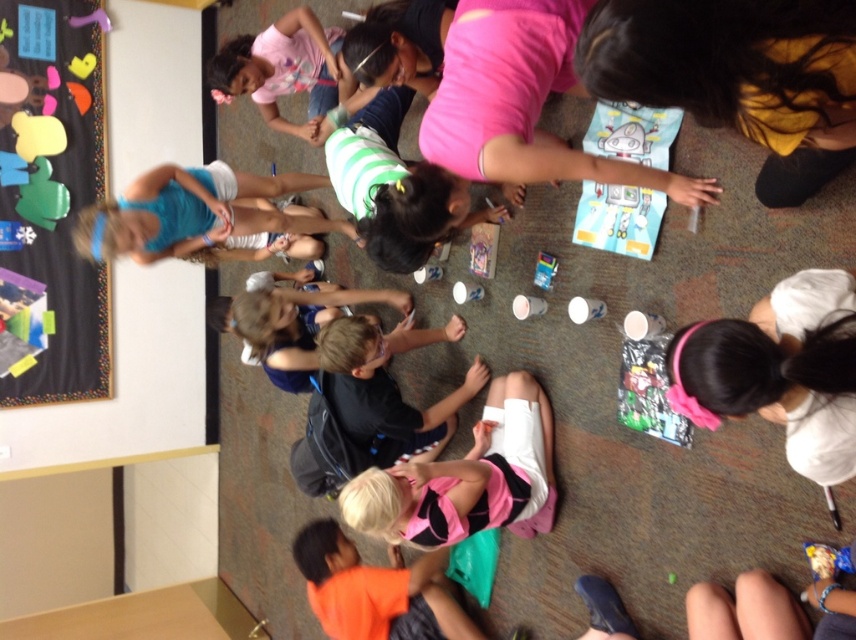
Question: Is black matte backpack at center above orange fabric at lower center?

Choices:
 (A) yes
 (B) no

Answer: (A)

Question: Which object is the farthest from the blue fabric dress at upper left?

Choices:
 (A) pink matte shirt at center
 (B) yellow fabric shirt at lower right
 (C) green striped shirt at center

Answer: (B)

Question: Does black matte backpack at center have a lesser width compared to green striped shirt at center?

Choices:
 (A) no
 (B) yes

Answer: (A)

Question: Which of the following is the farthest from the observer?

Choices:
 (A) (730, 369)
 (B) (176, 224)
 (C) (777, 189)
 (D) (455, 140)

Answer: (B)

Question: Does yellow fabric shirt at lower right appear on the left side of black matte backpack at center?

Choices:
 (A) yes
 (B) no

Answer: (B)

Question: Among these points, which one is nearest to the camera?

Choices:
 (A) (366, 358)
 (B) (465, 140)
 (C) (28, 300)

Answer: (B)